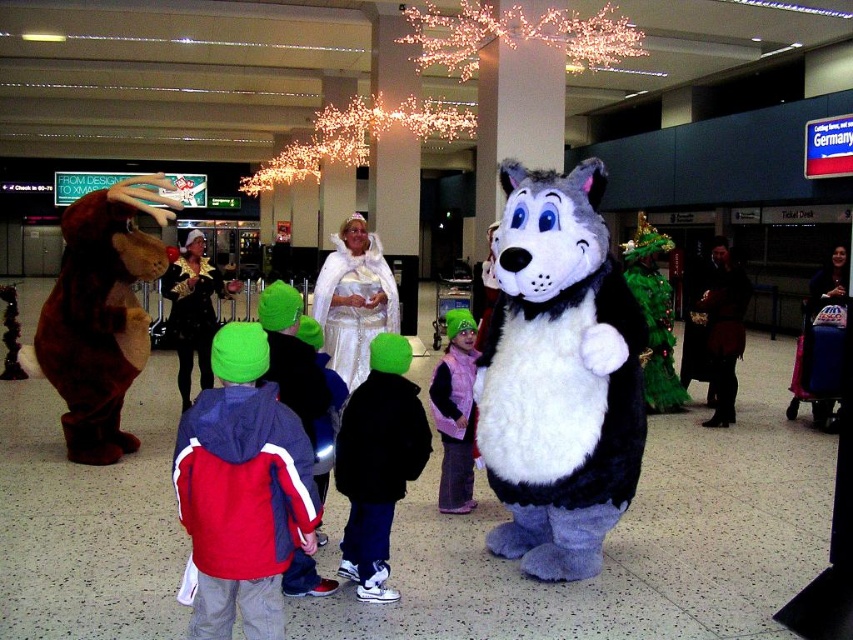
Does green fuzzy hat at center lie behind shiny gold costume at center?

No, it is in front of shiny gold costume at center.

Image resolution: width=853 pixels, height=640 pixels. What do you see at coordinates (378, 461) in the screenshot?
I see `green fuzzy hat at center` at bounding box center [378, 461].

In order to click on green fuzzy hat at center in this screenshot , I will do `click(378, 461)`.

Is fuzzy white and black wolf at center smaller than red and white jacket at center?

Actually, fuzzy white and black wolf at center might be larger than red and white jacket at center.

Is fuzzy white and black wolf at center to the right of red and white jacket at center from the viewer's perspective?

Indeed, fuzzy white and black wolf at center is positioned on the right side of red and white jacket at center.

Is point (538, 397) closer to camera compared to point (299, 374)?

No, (538, 397) is behind (299, 374).

Find the location of a particular element. The width and height of the screenshot is (853, 640). fuzzy white and black wolf at center is located at coordinates (560, 376).

Who is higher up, pink fleece vest at center or shiny gold costume at center?

shiny gold costume at center is above.

Who is more distant from viewer, (x=468, y=492) or (x=196, y=296)?

Positioned behind is point (x=196, y=296).

Find the location of a particular element. This screenshot has width=853, height=640. pink fleece vest at center is located at coordinates (456, 412).